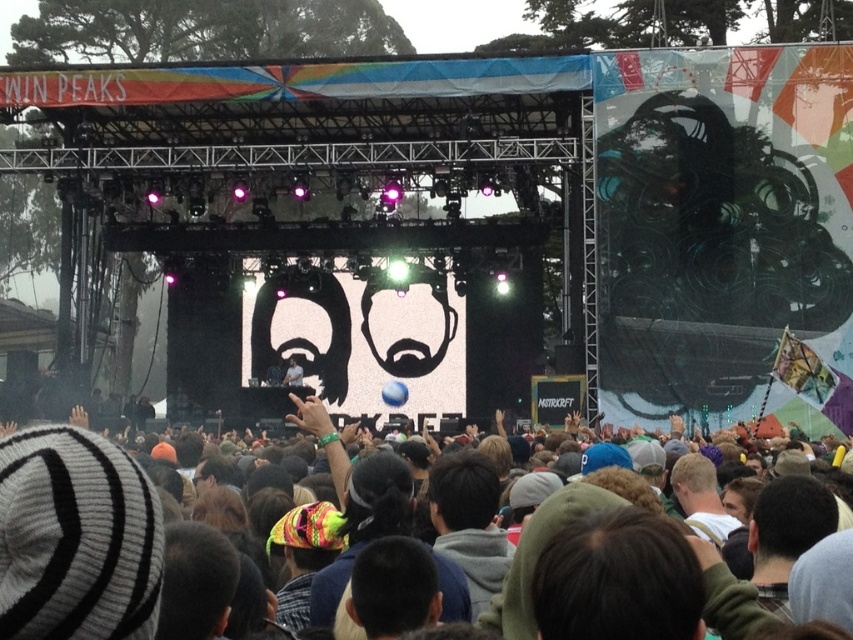
You are a photographer at the concert and want to capture both the black matte face at center and the smooth skin face at upper center in a single shot. Which face should you focus on first to ensure both are in frame?

The black matte face at center is larger than the smooth skin face at upper center, so focusing on the larger one first will help ensure both fit within the frame.

You are a photographer at the concert and want to capture both the multicolored fabric crowd at center and the matte yellow sunglasses at center in a single shot. Which object should you focus on first to ensure both are in frame?

You should focus on the multicolored fabric crowd at center first because it might be wider than the matte yellow sunglasses at center, so centering it would help include both in the frame.

You are a photographer at the concert and want to capture the stage visuals. You notice the black matte face at center and the matte yellow sunglasses at center. Which object should you focus on first if you want to photograph the one that is higher up?

The black matte face at center is positioned over matte yellow sunglasses at center, so you should focus on the black matte face at center first as it is higher up.